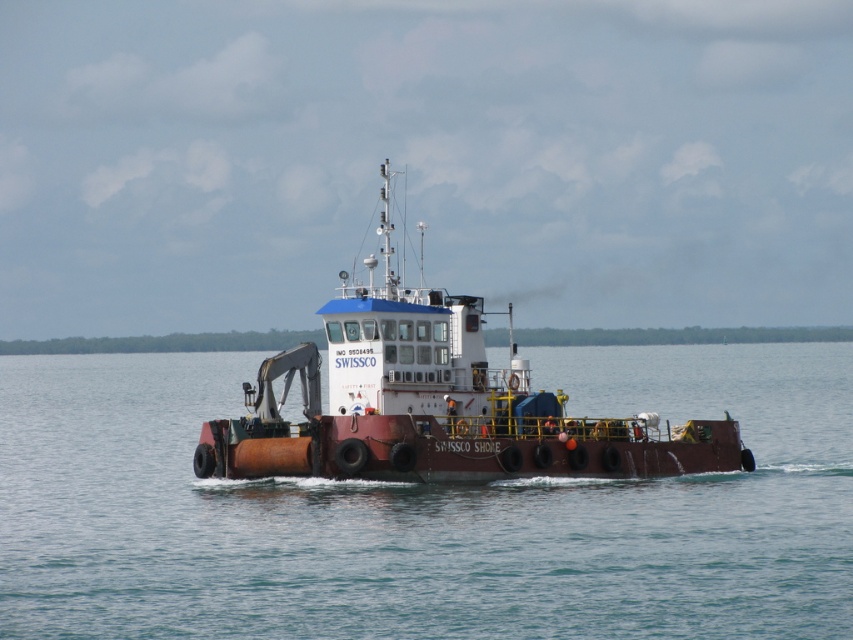
You are a maritime inspector examining the SWISSCO SHORE. You notice two objects labeled rusty metal water at center and rusty metal barge at center. Which object is located underneath the other?

The rusty metal water at center is positioned under the rusty metal barge at center, meaning the water is beneath the barge.

You are standing on the deck of the SWISSCO SHORE and want to move from point A to point B. Point A is located at coordinate point (618, 570) and point B is at coordinate point (444, 323). Which point is closer to you when you start at point A?

Point A is closer to the viewer than point B, so when starting at point A, point A is already closer to you compared to point B.